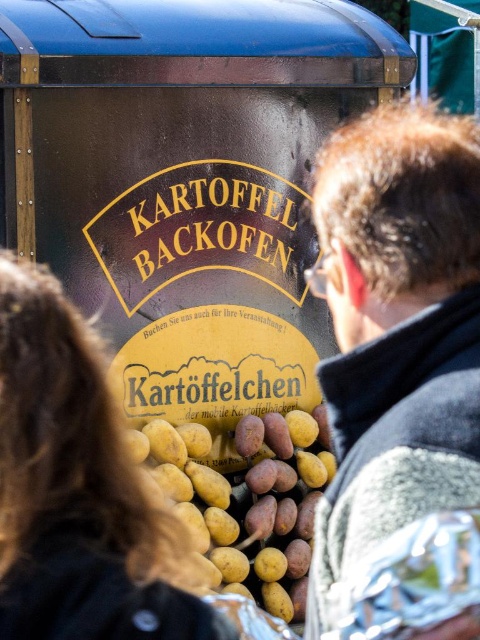
You are a customer looking at the mobile food stall and see the blonde hair at center and the yellow matte potatoes at center. Which one is closer to you?

The blonde hair at center is closer to you because it is in front of the yellow matte potatoes at center.

You are a customer at the mobile food stall and you want to order a potato. You notice a gray woolen jacket at center and a blonde hair at center. Which item is taller?

The gray woolen jacket at center is taller than the blonde hair at center.